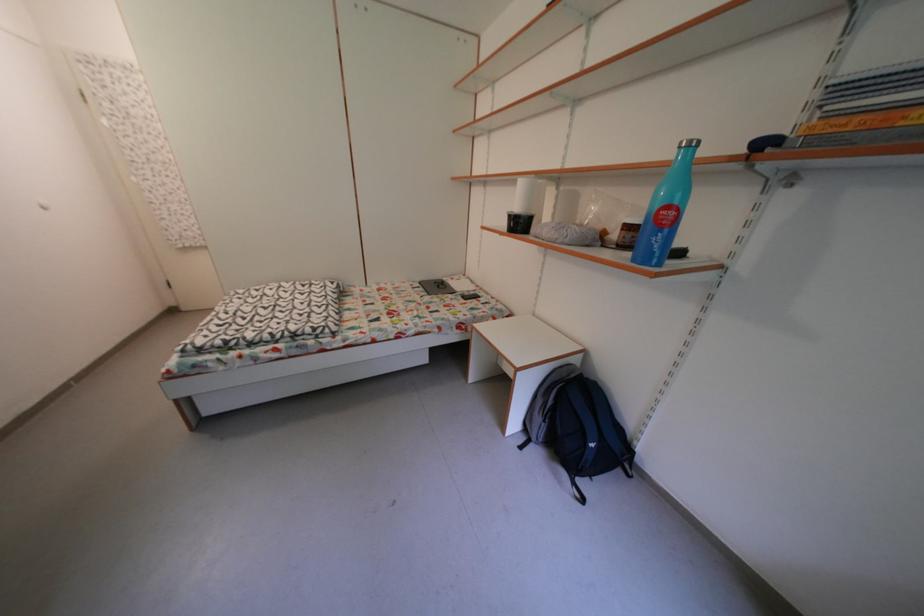
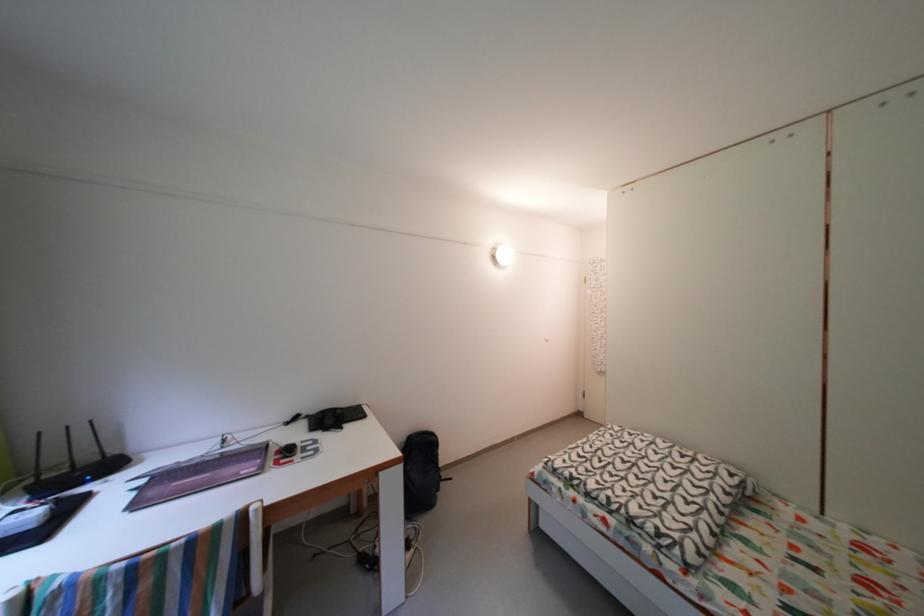
Question: The images are taken continuously from a first-person perspective. In which direction is your viewpoint rotating?

Choices:
 (A) Left
 (B) Right
 (C) Up
 (D) Down

Answer: (A)